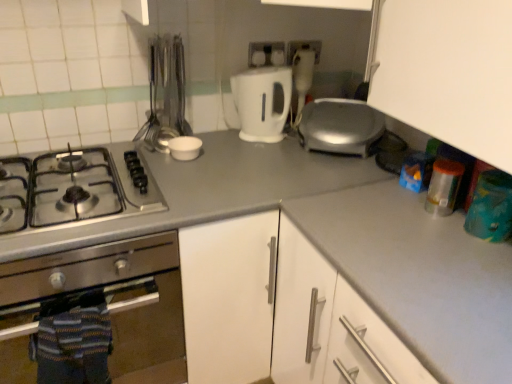
Question: Can you confirm if white plastic electric outlet at upper center, positioned as the second electric outlet in right-to-left order, is thinner than white glossy electric kettle at center, acting as the 2th kitchen appliance starting from the bottom?

Choices:
 (A) no
 (B) yes

Answer: (B)

Question: Does white plastic electric outlet at upper center, positioned as the second electric outlet in right-to-left order, have a greater width compared to white glossy electric kettle at center, acting as the 2th kitchen appliance starting from the bottom?

Choices:
 (A) yes
 (B) no

Answer: (B)

Question: Is white plastic electric outlet at upper center, positioned as the second electric outlet in right-to-left order, beside white glossy electric kettle at center, the second kitchen appliance viewed from the left?

Choices:
 (A) yes
 (B) no

Answer: (B)

Question: Considering the relative sizes of white plastic electric outlet at upper center, the 1th electric outlet from the left, and white glossy electric kettle at center, the second kitchen appliance viewed from the left, in the image provided, is white plastic electric outlet at upper center, the 1th electric outlet from the left, smaller than white glossy electric kettle at center, the second kitchen appliance viewed from the left,?

Choices:
 (A) no
 (B) yes

Answer: (B)

Question: Is white plastic electric outlet at upper center, the 1th electric outlet from the left, positioned far away from white glossy electric kettle at center, acting as the 2th kitchen appliance starting from the bottom?

Choices:
 (A) no
 (B) yes

Answer: (A)

Question: Would you say white plastic electric outlet at upper center, positioned as the second electric outlet in right-to-left order, is outside white glossy electric kettle at center, which is the first kitchen appliance in right-to-left order?

Choices:
 (A) yes
 (B) no

Answer: (A)

Question: Is stainless steel gas stove at left further to camera compared to white plastic electric outlet at upper center, positioned as the second electric outlet in right-to-left order?

Choices:
 (A) yes
 (B) no

Answer: (B)

Question: Is stainless steel gas stove at left taller than white plastic electric outlet at upper center, positioned as the second electric outlet in right-to-left order?

Choices:
 (A) no
 (B) yes

Answer: (A)

Question: Is stainless steel gas stove at left at the left side of white plastic electric outlet at upper center, positioned as the second electric outlet in right-to-left order?

Choices:
 (A) no
 (B) yes

Answer: (B)

Question: Would you say stainless steel gas stove at left is outside white plastic electric outlet at upper center, positioned as the second electric outlet in right-to-left order?

Choices:
 (A) no
 (B) yes

Answer: (B)

Question: Is stainless steel gas stove at left smaller than white plastic electric outlet at upper center, positioned as the second electric outlet in right-to-left order?

Choices:
 (A) no
 (B) yes

Answer: (A)

Question: Can you confirm if stainless steel gas stove at left is positioned to the right of white plastic electric outlet at upper center, positioned as the second electric outlet in right-to-left order?

Choices:
 (A) no
 (B) yes

Answer: (A)

Question: Does white plastic electric outlet at upper center, which is counted as the second electric outlet, starting from the left, come behind white plastic electric outlet at upper center, positioned as the second electric outlet in right-to-left order?

Choices:
 (A) no
 (B) yes

Answer: (B)